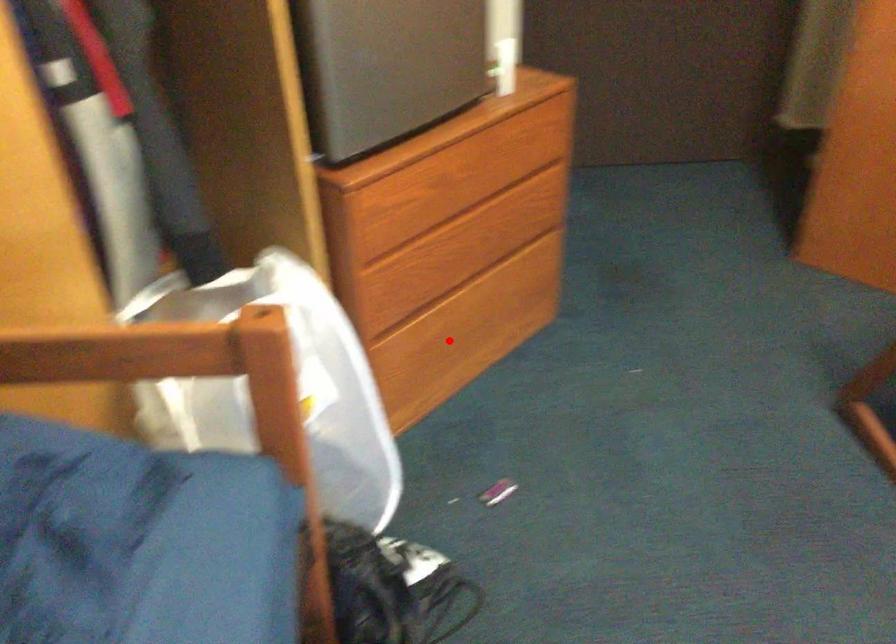
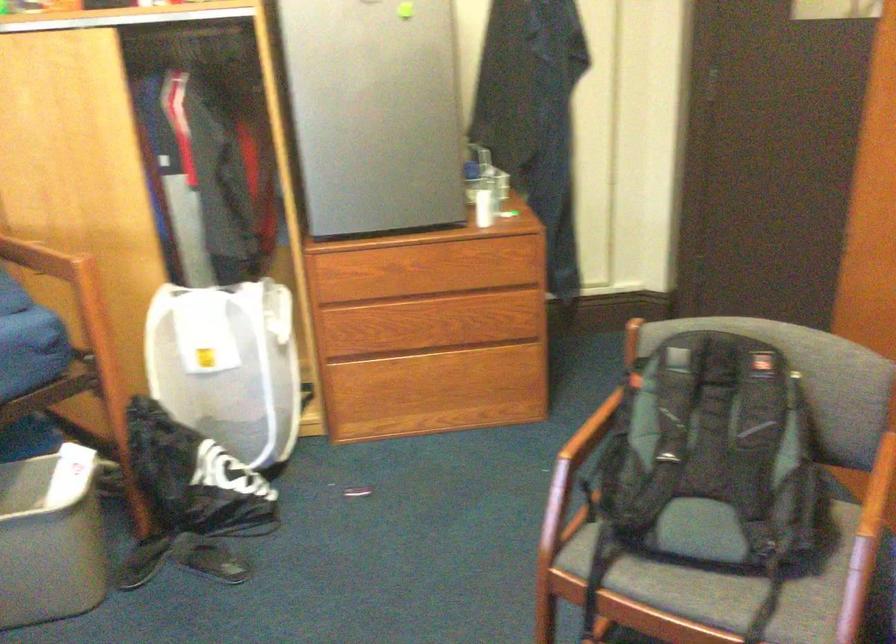
Locate, in the second image, the point that corresponds to the highlighted location in the first image.

(419, 397)